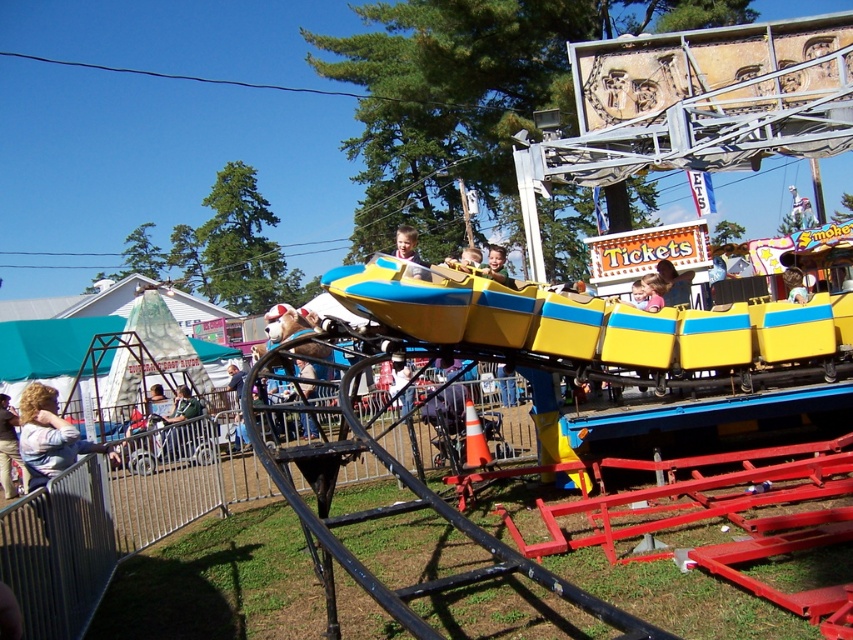
You are a parent standing at the ticket booth and want to ensure your child can comfortably ride the yellow plastic roller coaster at center while wearing the green fabric jacket at center. Since the jacket adds bulk, does the roller coaster have enough vertical clearance for the child?

The yellow plastic roller coaster at center has a greater height compared to the green fabric jacket at center, so there should be enough vertical clearance for the child to ride comfortably while wearing the jacket.

You are a photographer standing at the fairground. You want to take a photo of the light brown hair at lower left and the green fabric jacket at center. Which object should you focus on first if you want to capture both in the same frame?

The light brown hair at lower left is shorter than the green fabric jacket at center, so you should focus on the green fabric jacket at center first to ensure both are in the same frame.